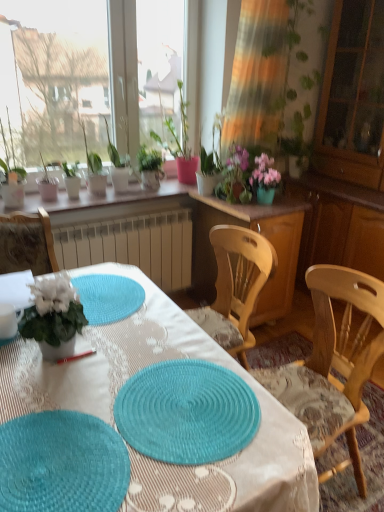
Image resolution: width=384 pixels, height=512 pixels. In order to click on free space to the left of white matte plant at left, the 5th houseplant from the left in this screenshot , I will do `click(14, 349)`.